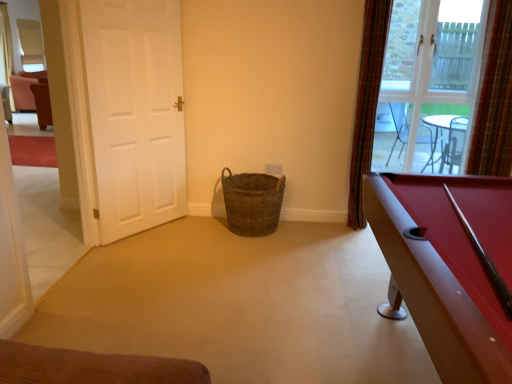
Question: Considering the relative sizes of brown woven basket at center and clear glass window at upper right in the image provided, is brown woven basket at center smaller than clear glass window at upper right?

Choices:
 (A) no
 (B) yes

Answer: (A)

Question: Is brown woven basket at center further to camera compared to clear glass window at upper right?

Choices:
 (A) no
 (B) yes

Answer: (A)

Question: Can you confirm if brown woven basket at center is taller than clear glass window at upper right?

Choices:
 (A) no
 (B) yes

Answer: (A)

Question: Does brown woven basket at center lie in front of clear glass window at upper right?

Choices:
 (A) no
 (B) yes

Answer: (B)

Question: Can you confirm if brown woven basket at center is wider than clear glass window at upper right?

Choices:
 (A) no
 (B) yes

Answer: (B)

Question: Based on their sizes in the image, would you say plaid fabric curtain at right, which is counted as the 2th curtain, starting from the right, is bigger or smaller than brown woven basket at center?

Choices:
 (A) big
 (B) small

Answer: (B)

Question: In the image, is plaid fabric curtain at right, which is counted as the 2th curtain, starting from the right, positioned in front of or behind brown woven basket at center?

Choices:
 (A) front
 (B) behind

Answer: (A)

Question: From the image's perspective, is plaid fabric curtain at right, which appears as the 1th curtain when viewed from the left, above or below brown woven basket at center?

Choices:
 (A) above
 (B) below

Answer: (A)

Question: In terms of width, does plaid fabric curtain at right, which appears as the 1th curtain when viewed from the left, look wider or thinner when compared to brown woven basket at center?

Choices:
 (A) thin
 (B) wide

Answer: (A)

Question: From a real-world perspective, is clear glass window at upper right positioned above or below rubberized red pool table at right?

Choices:
 (A) below
 (B) above

Answer: (B)

Question: Is clear glass window at upper right spatially inside rubberized red pool table at right, or outside of it?

Choices:
 (A) inside
 (B) outside

Answer: (B)

Question: Based on their positions, is clear glass window at upper right located to the left or right of rubberized red pool table at right?

Choices:
 (A) right
 (B) left

Answer: (A)

Question: From the image's perspective, is clear glass window at upper right located above or below rubberized red pool table at right?

Choices:
 (A) above
 (B) below

Answer: (A)

Question: Is white matte door at left bigger or smaller than plaid fabric curtain at right, which is counted as the 2th curtain, starting from the right?

Choices:
 (A) small
 (B) big

Answer: (B)

Question: Is point (168, 96) positioned closer to the camera than point (372, 97)?

Choices:
 (A) farther
 (B) closer

Answer: (A)